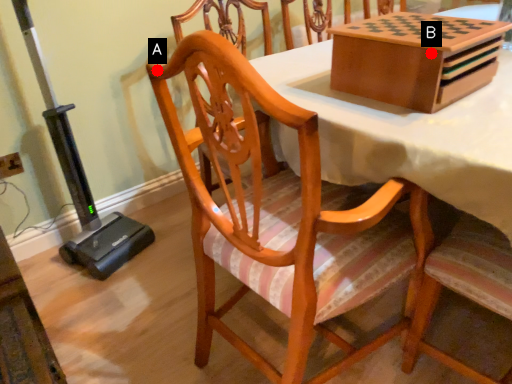
Question: Two points are circled on the image, labeled by A and B beside each circle. Among these points, which one is farthest from the camera?

Choices:
 (A) A is further
 (B) B is further

Answer: (B)